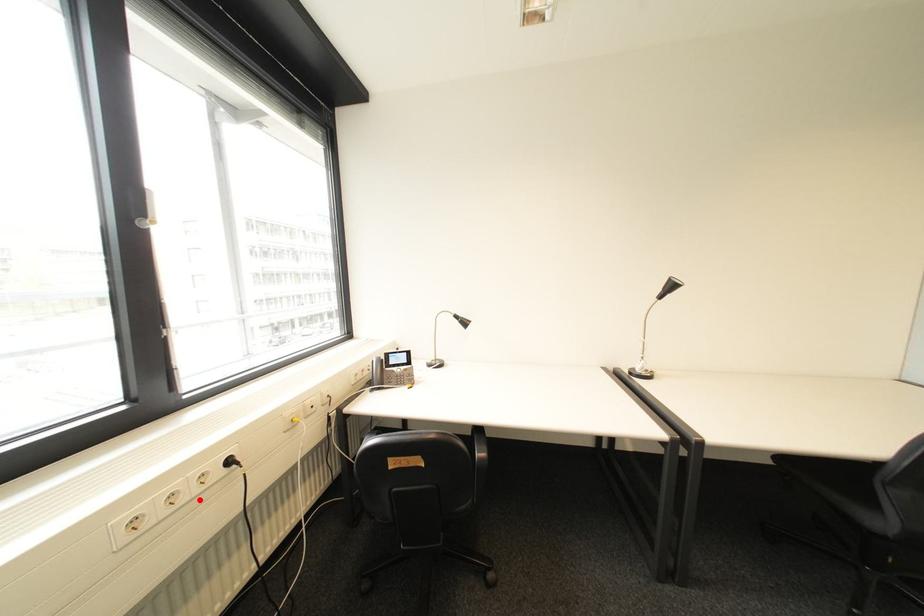
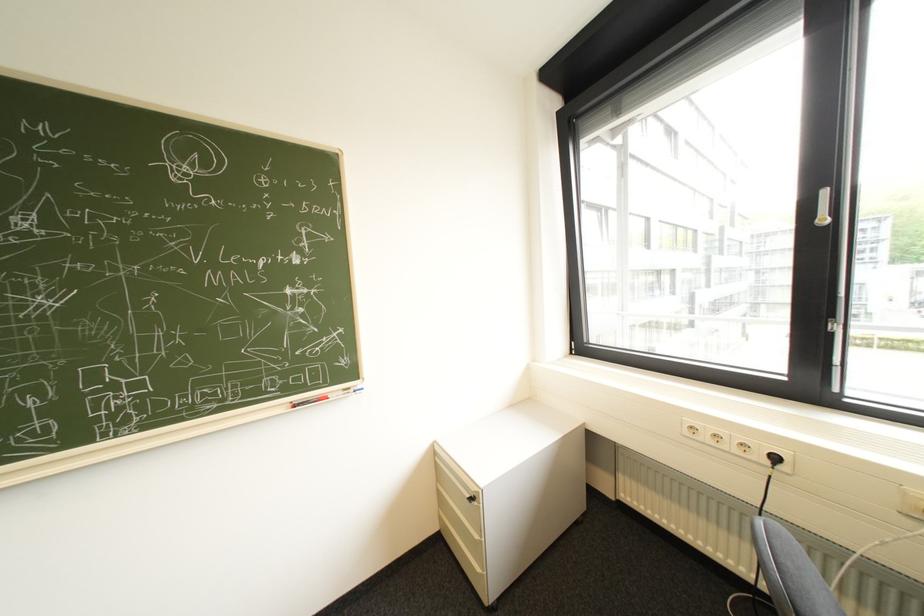
Locate, in the second image, the point that corresponds to the highlighted location in the first image.

(737, 450)